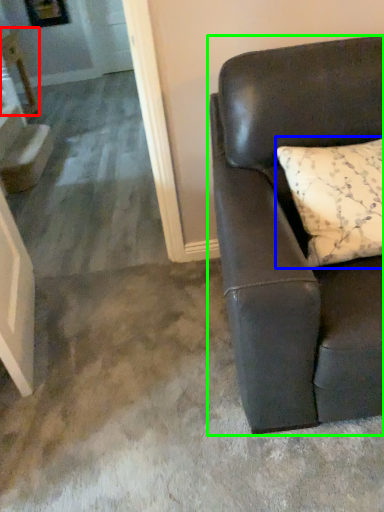
Question: Which object is positioned farthest from table (highlighted by a red box)? Select from pillow (highlighted by a blue box) and studio couch (highlighted by a green box).

Choices:
 (A) pillow
 (B) studio couch

Answer: (A)